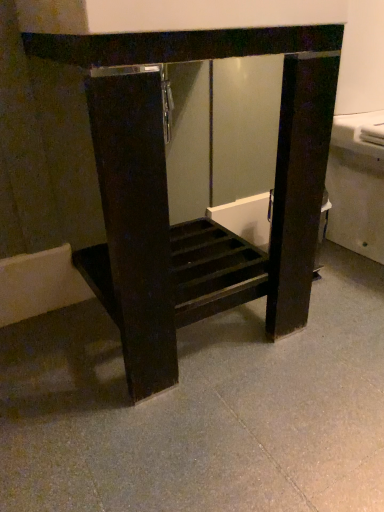
Question: Is gray polished concrete at center looking in the opposite direction of matte black cabinet at center?

Choices:
 (A) no
 (B) yes

Answer: (A)

Question: From the image's perspective, does gray polished concrete at center appear lower than matte black cabinet at center?

Choices:
 (A) no
 (B) yes

Answer: (B)

Question: Can you confirm if gray polished concrete at center is thinner than matte black cabinet at center?

Choices:
 (A) no
 (B) yes

Answer: (A)

Question: Is gray polished concrete at center wider than matte black cabinet at center?

Choices:
 (A) yes
 (B) no

Answer: (A)

Question: Can you confirm if gray polished concrete at center is bigger than matte black cabinet at center?

Choices:
 (A) no
 (B) yes

Answer: (A)

Question: Is gray polished concrete at center not near matte black cabinet at center?

Choices:
 (A) no
 (B) yes

Answer: (A)

Question: From the image's perspective, is matte black cabinet at center located above gray polished concrete at center?

Choices:
 (A) yes
 (B) no

Answer: (A)

Question: Can you confirm if matte black cabinet at center is shorter than gray polished concrete at center?

Choices:
 (A) yes
 (B) no

Answer: (B)

Question: Does matte black cabinet at center have a smaller size compared to gray polished concrete at center?

Choices:
 (A) no
 (B) yes

Answer: (A)

Question: Are matte black cabinet at center and gray polished concrete at center located far from each other?

Choices:
 (A) no
 (B) yes

Answer: (A)

Question: From a real-world perspective, is matte black cabinet at center on top of gray polished concrete at center?

Choices:
 (A) no
 (B) yes

Answer: (B)

Question: Can you confirm if matte black cabinet at center is thinner than gray polished concrete at center?

Choices:
 (A) no
 (B) yes

Answer: (B)

Question: Is point (309, 237) positioned closer to the camera than point (327, 434)?

Choices:
 (A) farther
 (B) closer

Answer: (A)